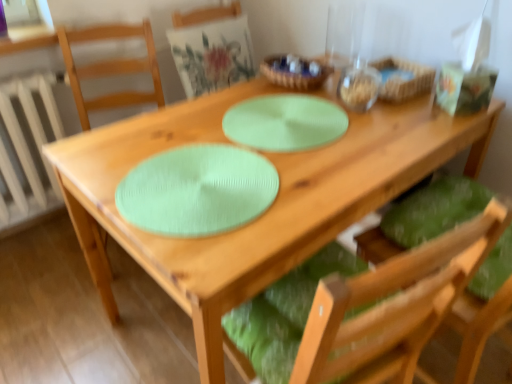
Question: Considering their positions, is wooden bowl at upper center located in front of or behind green fabric cushion at center, the second chair when ordered from left to right?

Choices:
 (A) front
 (B) behind

Answer: (B)

Question: From a real-world perspective, relative to green fabric cushion at center, the second chair positioned from the right, is wooden bowl at upper center vertically above or below?

Choices:
 (A) below
 (B) above

Answer: (B)

Question: Which is nearer to the green textured placemat at center?

Choices:
 (A) matte green cushion at upper center, the 1th chair positioned from the left
 (B) green fabric cushion at center, the second chair positioned from the right
 (C) white painted metal radiator at left
 (D) woven wood basket at upper right
 (E) mint green textured placemat at center

Answer: (E)

Question: Which object is the farthest from the green fabric cushion at lower right, the 3th chair from the left?

Choices:
 (A) green fabric cushion at center, the second chair positioned from the right
 (B) woven wood basket at upper right
 (C) white painted metal radiator at left
 (D) green textured placemat at center
 (E) matte green cushion at upper center, the 1th chair positioned from the left

Answer: (C)